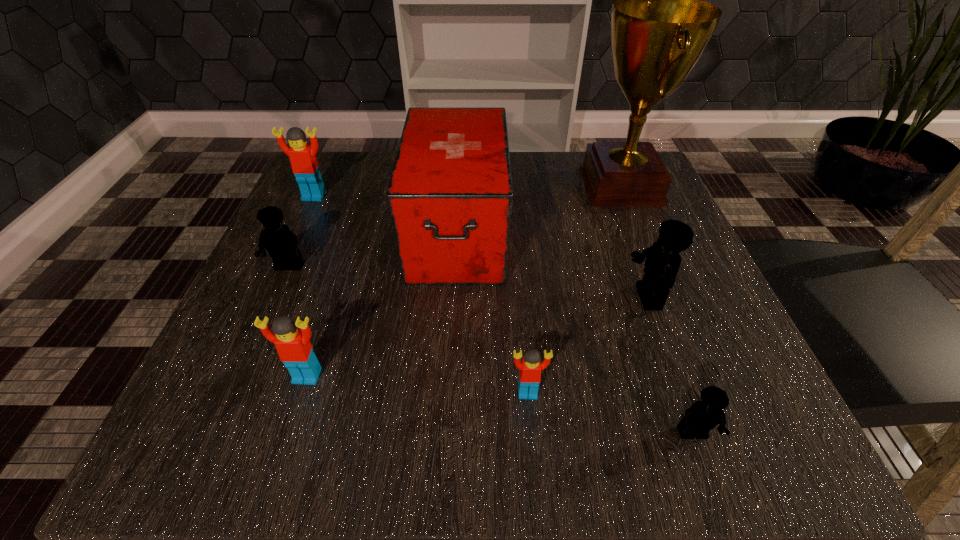
At what (x,y) coordinates should I click in order to perform the action: click on blank area located on the front-facing side of the fourth nearest Lego. Please return your answer as a coordinate pair (x, y). The height and width of the screenshot is (540, 960). Looking at the image, I should click on (430, 298).

The image size is (960, 540). Identify the location of free region located on the front-facing side of the fourth nearest Lego. (423, 298).

Find the location of a particular element. The width and height of the screenshot is (960, 540). vacant space situated on the front-facing side of the fourth nearest Lego is located at coordinates (387, 298).

At what (x,y) coordinates should I click in order to perform the action: click on vacant space located 0.080m on the face of the second nearest red Lego. Please return your answer as a coordinate pair (x, y). Looking at the image, I should click on (286, 442).

At what (x,y) coordinates should I click in order to perform the action: click on free location located 0.250m on the front-facing side of the farthest yellow Lego. Please return your answer as a coordinate pair (x, y). The height and width of the screenshot is (540, 960). Looking at the image, I should click on (224, 413).

Where is `vacant area situated on the face of the smallest red Lego`? This screenshot has height=540, width=960. vacant area situated on the face of the smallest red Lego is located at coordinates (532, 436).

At what (x,y) coordinates should I click in order to perform the action: click on award located in the far edge section of the desktop. Please return your answer as a coordinate pair (x, y). Looking at the image, I should click on (660, 27).

Identify the location of the first-aid kit positioned at the far edge. [450, 195].

Where is `Lego that is positioned at the far edge`? The height and width of the screenshot is (540, 960). Lego that is positioned at the far edge is located at coordinates (305, 167).

Where is `award that is at the right edge`? Image resolution: width=960 pixels, height=540 pixels. award that is at the right edge is located at coordinates (660, 27).